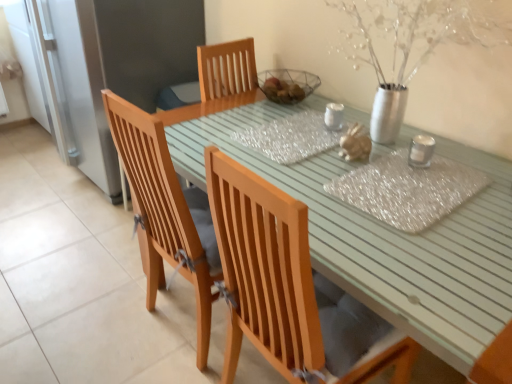
At what (x,y) coordinates should I click in order to perform the action: click on spots to the right of translucent glass jar at center. Please return your answer as a coordinate pair (x, y). Looking at the image, I should click on (392, 150).